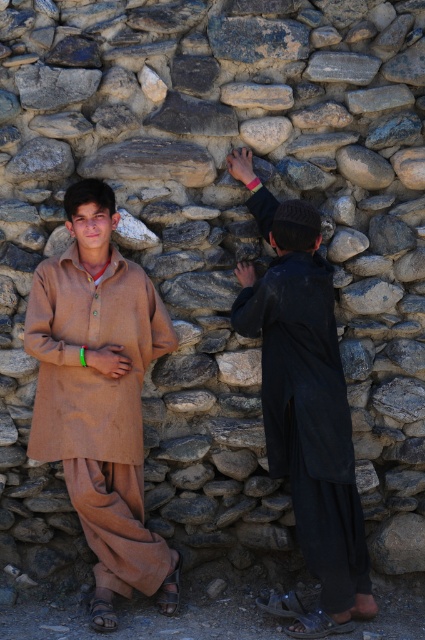
You are an architect analyzing the positioning of clothing items in the scene. Given the coordinates of the matte brown kurta at center, can you determine its exact location relative to the rough stone wall?

The matte brown kurta at center is located at coordinates point (99, 396), which places it centrally within the scene, positioned against the rough stone wall backdrop.

You are a fashion designer observing two outfits in the image. The first is a matte brown kurta at center and the second is black matte clothing at right. Which outfit is smaller in size?

The matte brown kurta at center has a smaller size compared to black matte clothing at right.